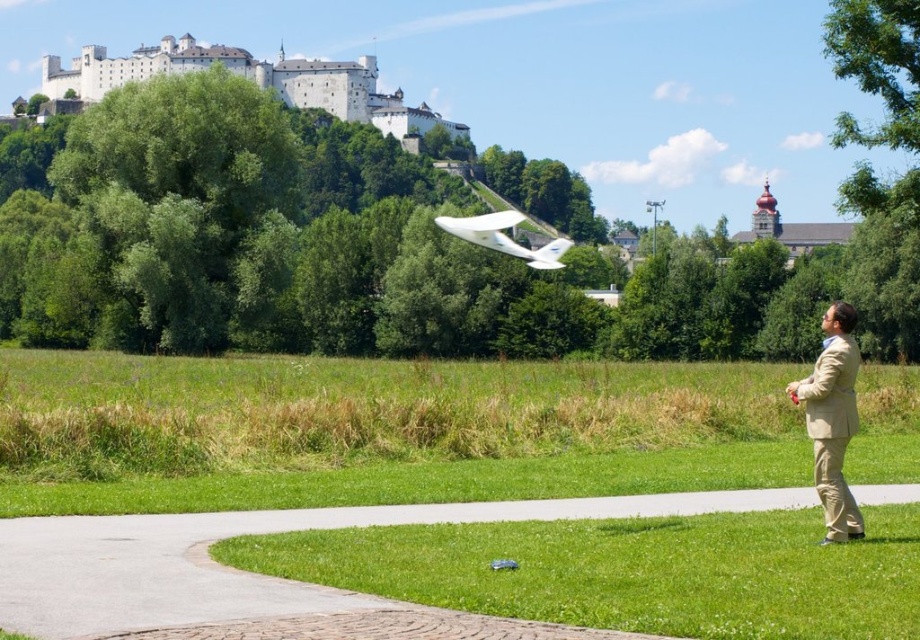
Question: Does tan fabric suit at right appear on the left side of white matte glider at center?

Choices:
 (A) yes
 (B) no

Answer: (B)

Question: Estimate the real-world distances between objects in this image. Which object is farther from the white matte glider at center?

Choices:
 (A) green grass at lower right
 (B) tan fabric suit at right

Answer: (B)

Question: In this image, where is tan fabric suit at right located relative to white matte glider at center?

Choices:
 (A) left
 (B) right

Answer: (B)

Question: Which object is the farthest from the green grass at lower right?

Choices:
 (A) white matte glider at center
 (B) tan fabric suit at right

Answer: (B)

Question: Which point appears farthest from the camera in this image?

Choices:
 (A) (180, 490)
 (B) (439, 221)

Answer: (B)

Question: Where is green grass at lower right located in relation to tan fabric suit at right in the image?

Choices:
 (A) left
 (B) right

Answer: (A)